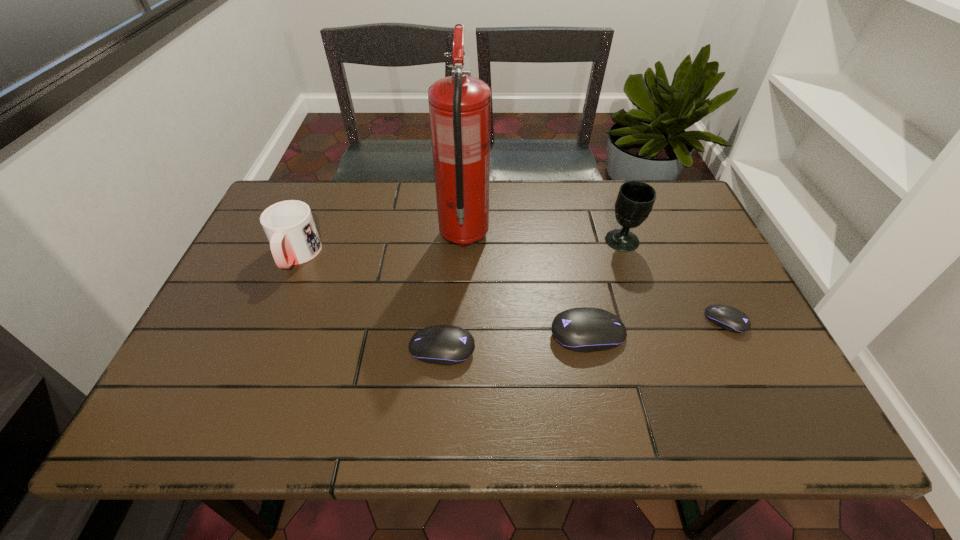
Image resolution: width=960 pixels, height=540 pixels. In order to click on the second shortest computer mouse in this screenshot , I will do `click(446, 345)`.

This screenshot has width=960, height=540. Identify the location of the leftmost computer mouse. (446, 345).

Find the location of `the third object from right to left`. the third object from right to left is located at coordinates (584, 329).

The image size is (960, 540). What are the coordinates of `the rightmost computer mouse` in the screenshot? It's located at (731, 319).

Find the location of `the rightmost object`. the rightmost object is located at coordinates (731, 319).

Where is `the fifth shortest object`? This screenshot has width=960, height=540. the fifth shortest object is located at coordinates (635, 200).

Find the location of `chalice`. chalice is located at coordinates (635, 200).

Where is `fire extinguisher`? fire extinguisher is located at coordinates (459, 105).

Identify the location of the fourth shortest object. Image resolution: width=960 pixels, height=540 pixels. (289, 226).

Image resolution: width=960 pixels, height=540 pixels. I want to click on mug, so click(289, 226).